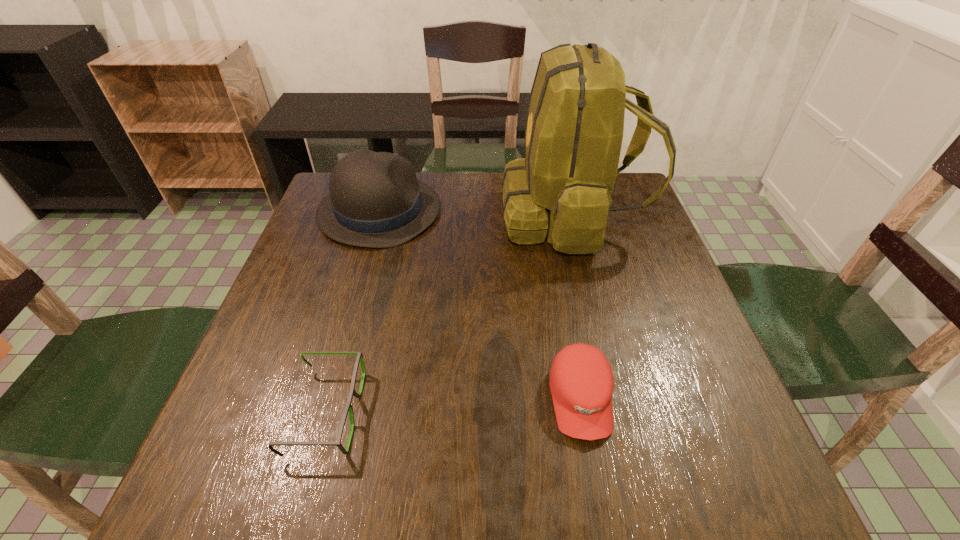
What are the coordinates of `backpack located at the far edge` in the screenshot? It's located at (562, 189).

Where is `bowler hat that is at the far edge`? bowler hat that is at the far edge is located at coordinates (375, 200).

The image size is (960, 540). What are the coordinates of `object present at the near edge` in the screenshot? It's located at (348, 407).

Find the location of a particular element. The image size is (960, 540). bowler hat situated at the left edge is located at coordinates (375, 200).

Find the location of a particular element. The height and width of the screenshot is (540, 960). spectacles that is positioned at the left edge is located at coordinates (348, 407).

Identify the location of object that is at the right edge. (562, 189).

The image size is (960, 540). Identify the location of object positioned at the far left corner. (375, 200).

This screenshot has height=540, width=960. Find the location of `object positioned at the near left corner`. object positioned at the near left corner is located at coordinates click(348, 407).

Image resolution: width=960 pixels, height=540 pixels. In order to click on object that is positioned at the far right corner in this screenshot , I will do `click(562, 189)`.

Where is `free space at the far edge of the desktop`? The width and height of the screenshot is (960, 540). free space at the far edge of the desktop is located at coordinates (425, 182).